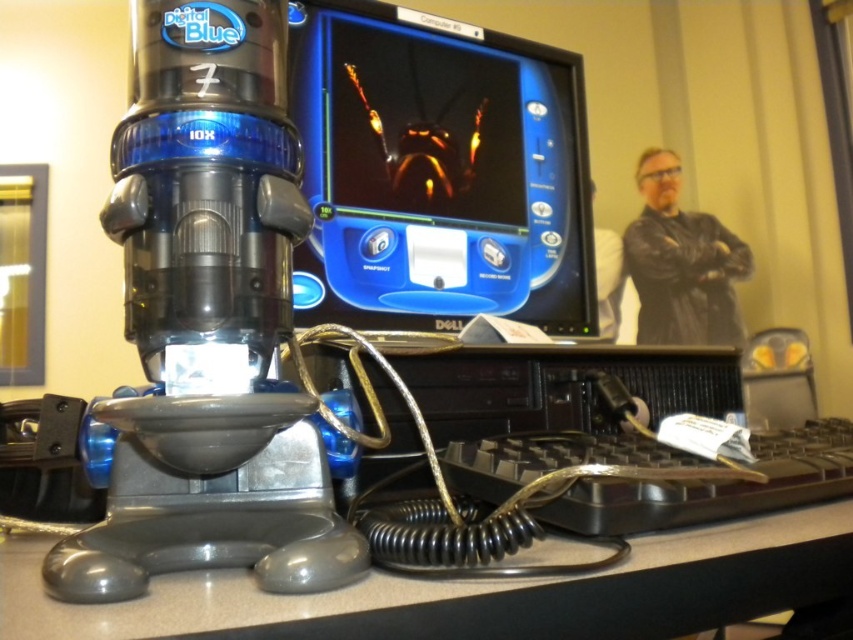
How far apart are metallic gray microscope at center and matte black monitor at center?

They are 14.97 inches apart.

Is point (245, 468) less distant than point (431, 227)?

Yes, it is.

Does point (161, 253) come closer to viewer compared to point (341, 38)?

Yes, point (161, 253) is closer to viewer.

What are the coordinates of `metallic gray microscope at center` in the screenshot? It's located at (207, 321).

Consider the image. Who is positioned more to the right, black plastic keyboard at lower right or black leather jacket at upper right?

Positioned to the right is black leather jacket at upper right.

Can you confirm if black plastic keyboard at lower right is positioned above black leather jacket at upper right?

No, black plastic keyboard at lower right is not above black leather jacket at upper right.

Who is more distant from viewer, [552,500] or [711,284]?

Point [711,284]

The height and width of the screenshot is (640, 853). I want to click on black plastic keyboard at lower right, so click(714, 486).

Is metallic gray microscope at center positioned behind gray plastic table at lower center?

Yes, metallic gray microscope at center is further from the viewer.

What do you see at coordinates (207, 321) in the screenshot? I see `metallic gray microscope at center` at bounding box center [207, 321].

You are a GUI agent. You are given a task and a screenshot of the screen. Output one action in this format:
    pyautogui.click(x=<x>, y=<y>)
    Task: Click on the metallic gray microscope at center
    This screenshot has width=853, height=640.
    Given the screenshot: What is the action you would take?
    pyautogui.click(x=207, y=321)

Locate an element on the screen. metallic gray microscope at center is located at coordinates 207,321.